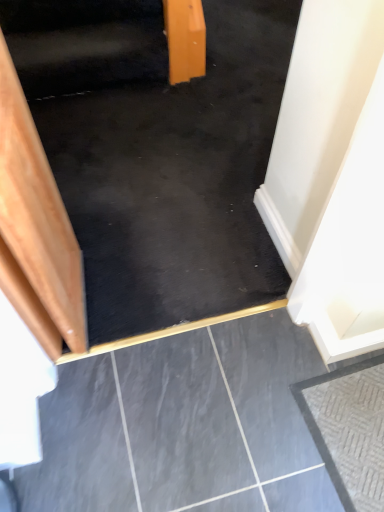
Question: From a real-world perspective, does black rubber stairwell at upper center stand above black polished concrete at center, the second concrete positioned from the right?

Choices:
 (A) yes
 (B) no

Answer: (A)

Question: From the image's perspective, is black rubber stairwell at upper center beneath black polished concrete at center, placed as the 1th concrete when sorted from left to right?

Choices:
 (A) yes
 (B) no

Answer: (B)

Question: Is black rubber stairwell at upper center outside of black polished concrete at center, the second concrete positioned from the right?

Choices:
 (A) yes
 (B) no

Answer: (A)

Question: Is the position of black rubber stairwell at upper center more distant than that of black polished concrete at center, the second concrete positioned from the right?

Choices:
 (A) no
 (B) yes

Answer: (B)

Question: Can you confirm if black rubber stairwell at upper center is thinner than black polished concrete at center, the second concrete positioned from the right?

Choices:
 (A) no
 (B) yes

Answer: (B)

Question: Is black rubber stairwell at upper center to the right of black polished concrete at center, placed as the 1th concrete when sorted from left to right, from the viewer's perspective?

Choices:
 (A) yes
 (B) no

Answer: (B)

Question: From a real-world perspective, is black rubber stairwell at upper center physically above textured gray concrete at lower right, the second concrete positioned from the left?

Choices:
 (A) yes
 (B) no

Answer: (A)

Question: Is black rubber stairwell at upper center facing away from textured gray concrete at lower right, which appears as the first concrete when viewed from the right?

Choices:
 (A) no
 (B) yes

Answer: (A)

Question: From a real-world perspective, is black rubber stairwell at upper center physically below textured gray concrete at lower right, the second concrete positioned from the left?

Choices:
 (A) yes
 (B) no

Answer: (B)

Question: Is the position of black rubber stairwell at upper center less distant than that of textured gray concrete at lower right, which appears as the first concrete when viewed from the right?

Choices:
 (A) no
 (B) yes

Answer: (A)

Question: Can you confirm if black rubber stairwell at upper center is wider than textured gray concrete at lower right, the second concrete positioned from the left?

Choices:
 (A) yes
 (B) no

Answer: (B)

Question: Can textured gray concrete at lower right, which appears as the first concrete when viewed from the right, be found inside black rubber stairwell at upper center?

Choices:
 (A) no
 (B) yes

Answer: (A)

Question: From a real-world perspective, does wooden stairs at left stand above black rubber stairwell at upper center?

Choices:
 (A) no
 (B) yes

Answer: (A)